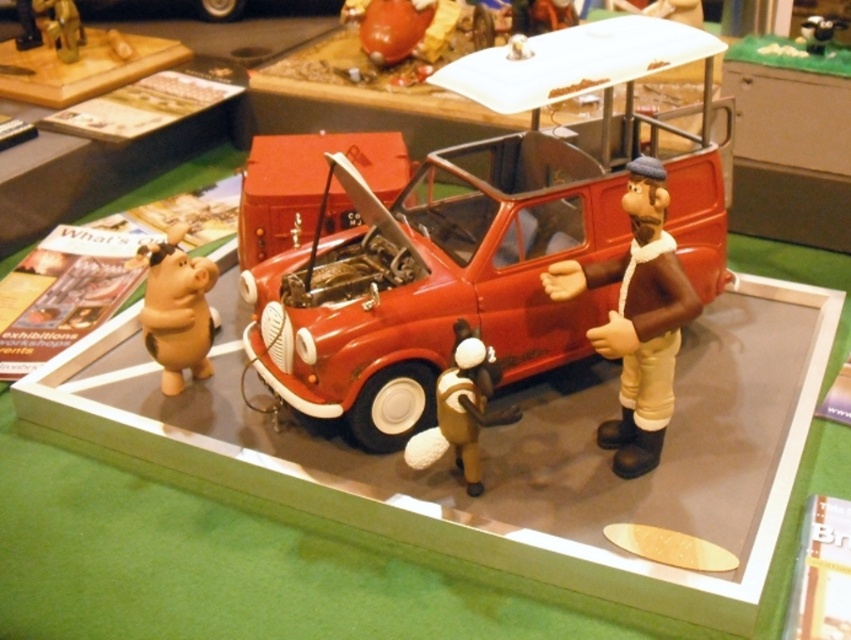
You are a visitor at the exhibition and want to take a photo of the shiny red car at center and the matte brown figure at center. Which object is taller so that it can be fully captured in the frame without cropping?

The shiny red car at center is taller than the matte brown figure at center, so it can be fully captured in the frame without cropping.